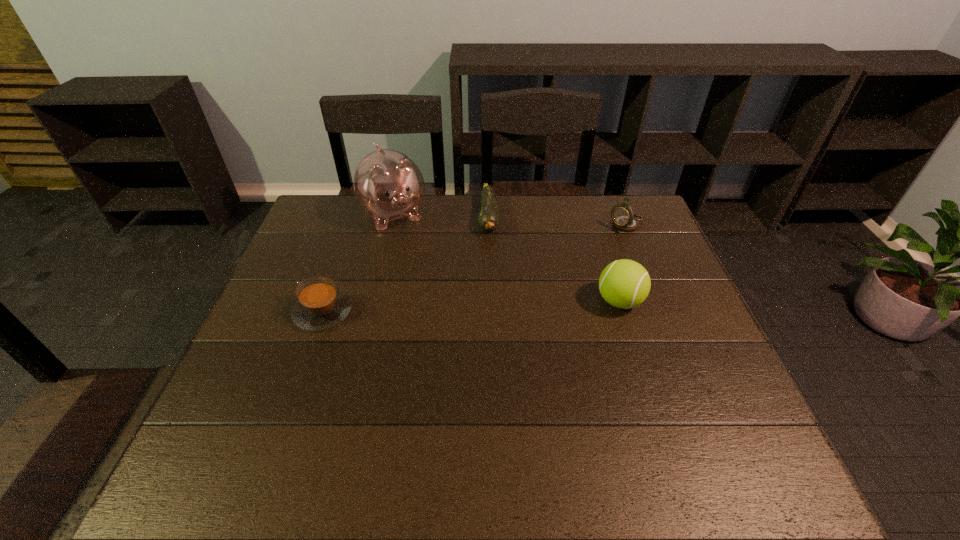
Locate an element on the screen. The image size is (960, 540). blank area located on the face of the compass is located at coordinates (553, 272).

The image size is (960, 540). In order to click on vacant region located 0.300m at the blossom end of the third object from right to left in this screenshot , I will do 484,312.

At what (x,y) coordinates should I click in order to perform the action: click on vacant space positioned at the blossom end of the third object from right to left. Please return your answer as a coordinate pair (x, y). The height and width of the screenshot is (540, 960). Looking at the image, I should click on (487, 260).

This screenshot has width=960, height=540. What are the coordinates of `vacant space located 0.270m at the blossom end of the third object from right to left` in the screenshot? It's located at (484, 304).

Identify the location of vacant space situated 0.140m on the front facing side of the tallest object. The image size is (960, 540). (418, 262).

Locate an element on the screen. vacant region located on the front facing side of the tallest object is located at coordinates (422, 271).

At what (x,y) coordinates should I click in order to perform the action: click on free space located 0.330m on the front facing side of the tallest object. Please return your answer as a coordinate pair (x, y). This screenshot has height=540, width=960. Looking at the image, I should click on (442, 306).

At what (x,y) coordinates should I click in order to perform the action: click on compass located at the far edge. Please return your answer as a coordinate pair (x, y). Looking at the image, I should click on (624, 219).

The width and height of the screenshot is (960, 540). In order to click on zucchini that is positioned at the far edge in this screenshot , I will do `click(488, 219)`.

The height and width of the screenshot is (540, 960). In order to click on piggy bank present at the far edge in this screenshot , I will do `click(389, 186)`.